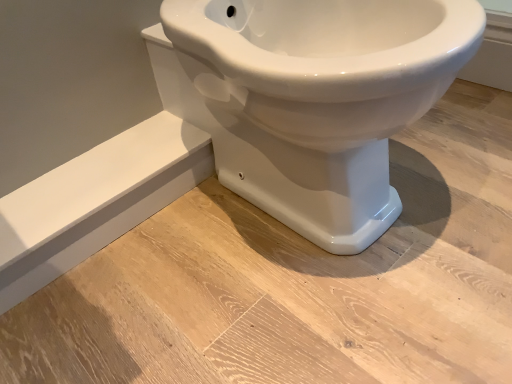
What are the coordinates of `vacant region to the left of white glossy toilet at center` in the screenshot? It's located at (143, 292).